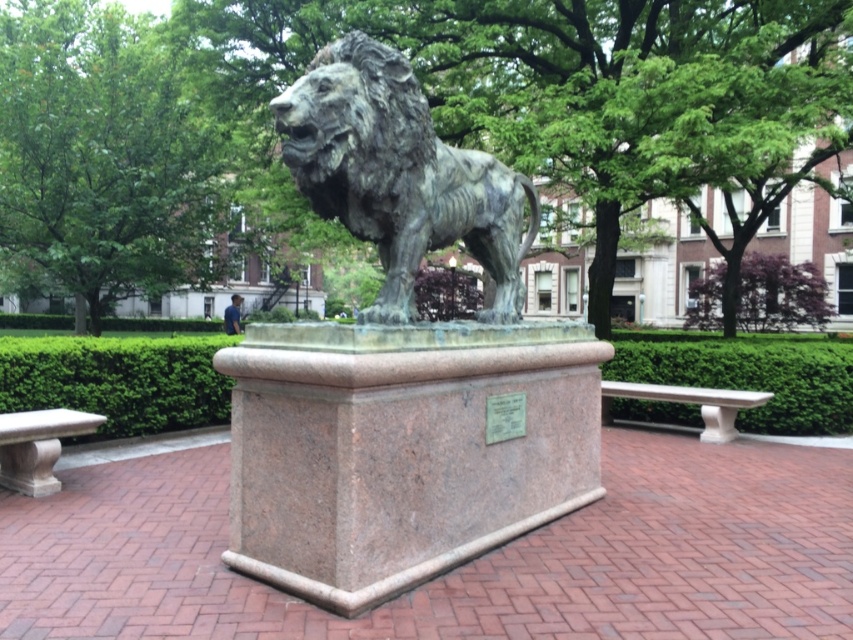
Question: Can you confirm if green leafy hedge at lower left is wider than green leafy hedge at center?

Choices:
 (A) yes
 (B) no

Answer: (A)

Question: Can you confirm if green leafy hedge at lower left is positioned to the left of white marble bench at right?

Choices:
 (A) no
 (B) yes

Answer: (B)

Question: Which point appears farthest from the camera in this image?

Choices:
 (A) (647, 371)
 (B) (372, 157)
 (C) (65, 339)

Answer: (A)

Question: Which of these objects is positioned farthest from the green leafy hedge at lower left?

Choices:
 (A) bronze textured lion at center
 (B) white marble bench at right
 (C) smooth stone bench at lower left
 (D) green leafy hedge at center

Answer: (D)

Question: Can you confirm if green leafy hedge at center is smaller than white marble bench at right?

Choices:
 (A) yes
 (B) no

Answer: (A)

Question: Which is nearer to the green leafy hedge at center?

Choices:
 (A) bronze textured lion at center
 (B) white marble bench at right
 (C) smooth stone bench at lower left

Answer: (B)